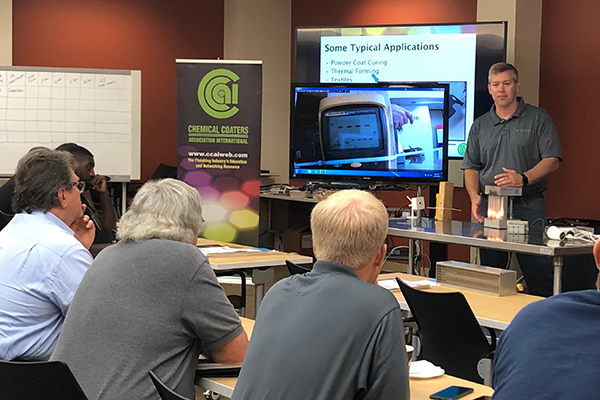
The image size is (600, 400). I want to click on white board, so pyautogui.click(x=81, y=109).